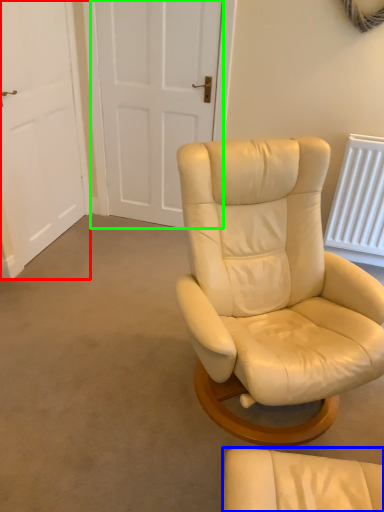
Question: Considering the real-world distances, which object is closest to door (highlighted by a red box)? chair (highlighted by a blue box) or door (highlighted by a green box).

Choices:
 (A) chair
 (B) door

Answer: (B)